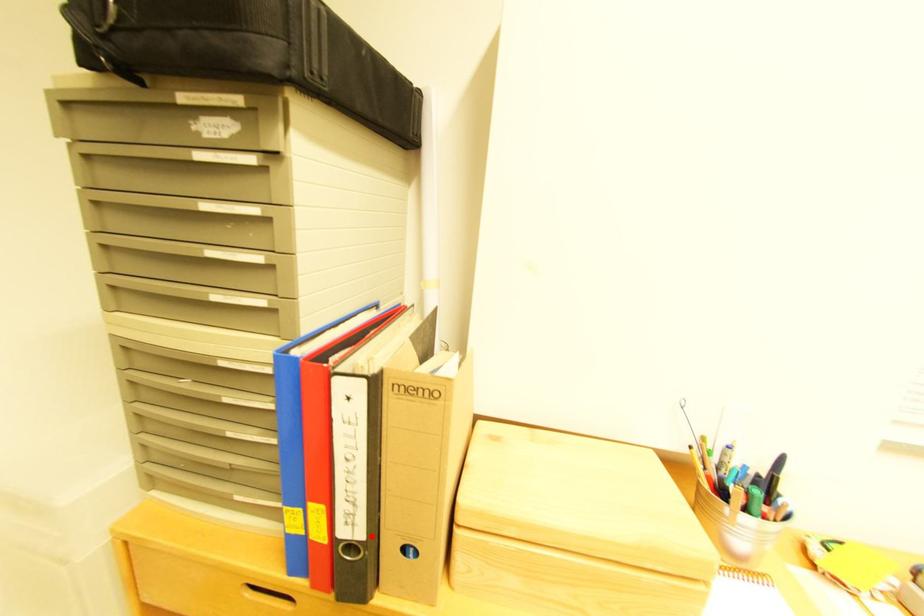
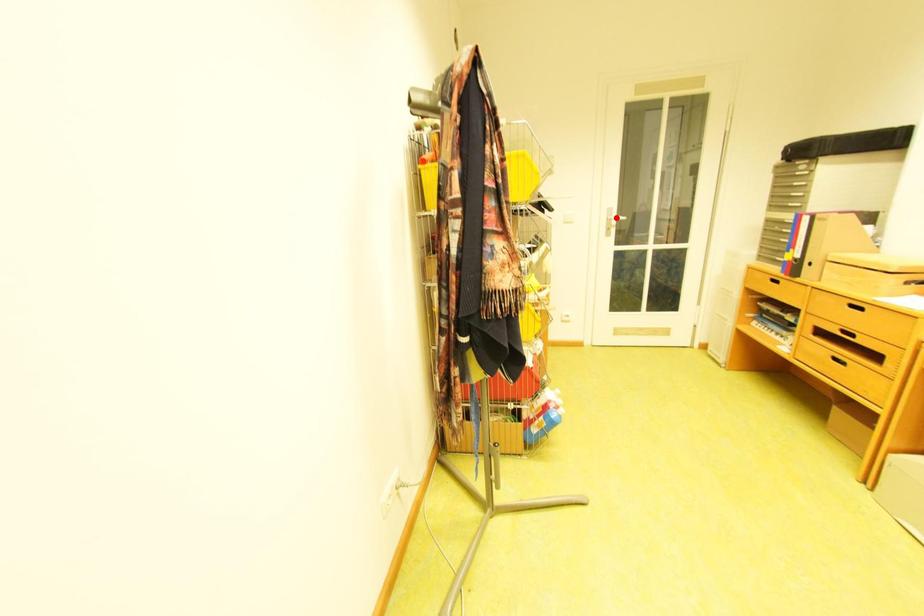
I am providing you with two images of the same scene from different viewpoints. A red point is marked on the first image and another point is marked on the second image. Do the highlighted points in image1 and image2 indicate the same real-world spot?

No